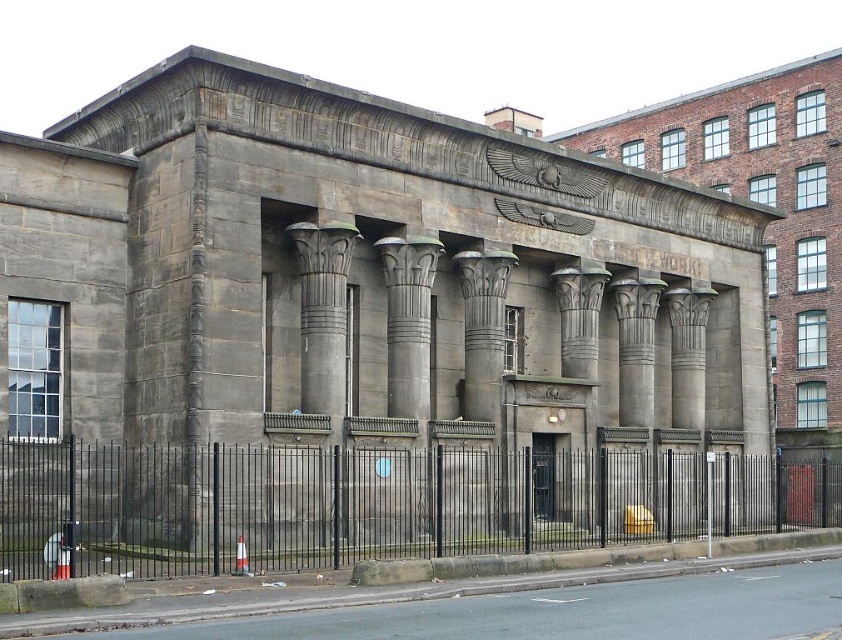
You are standing at the entrance of the ancient Egyptian inspired structure. You see the black metal fence at lower center and the gray stone column at center. Which object is closer to you?

The black metal fence at lower center is closer to you because it is positioned in front of the gray stone column at center.

You are standing at the entrance of the ancient Egyptian inspired building and notice a black metal fence at lower center and a gray stone column at center. Which object is positioned more to the right from your viewpoint?

The black metal fence at lower center is positioned more to the right compared to the gray stone column at center.

You are an architect designing a new garden pathway that must pass between the black metal fence at lower center and the gray stone column at center. Based on the scene, can you determine if there is enough space for the pathway to go between them?

The black metal fence at lower center is positioned under the gray stone column at center, meaning they are vertically aligned. Since the pathway requires horizontal space between them and they are stacked vertically, there is insufficient space for the pathway to pass between them horizontally.